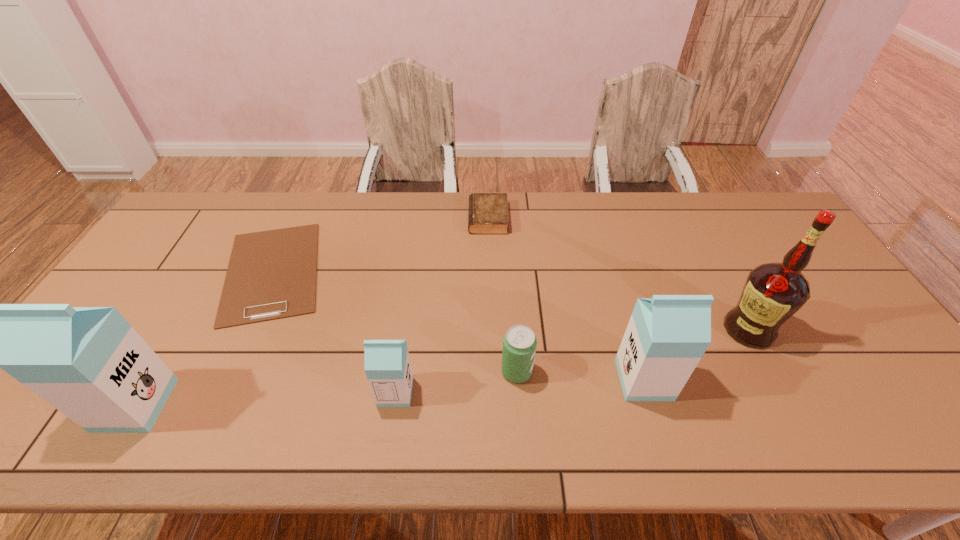
The image size is (960, 540). Identify the location of vacant space that satisfies the following two spatial constraints: 1. on the label of the alcohol; 2. on the front side of the fifth tallest object. (770, 372).

This screenshot has width=960, height=540. Find the location of `free space that satisfies the following two spatial constraints: 1. on the spine side of the diary; 2. on the front side of the leftmost milk carton`. free space that satisfies the following two spatial constraints: 1. on the spine side of the diary; 2. on the front side of the leftmost milk carton is located at coordinates (492, 405).

You are a GUI agent. You are given a task and a screenshot of the screen. Output one action in this format:
    pyautogui.click(x=<x>, y=<y>)
    Task: Click on the vacant region that satisfies the following two spatial constraints: 1. on the front side of the soda; 2. on the left side of the clipboard
    
    Given the screenshot: What is the action you would take?
    pyautogui.click(x=227, y=372)

Where is `free region that satisfies the following two spatial constraints: 1. on the front side of the soda; 2. on the left side of the clipboard`? Image resolution: width=960 pixels, height=540 pixels. free region that satisfies the following two spatial constraints: 1. on the front side of the soda; 2. on the left side of the clipboard is located at coordinates (227, 372).

Find the location of `free location that satisfies the following two spatial constraints: 1. on the front side of the rightmost milk carton; 2. on the left side of the clipboard`. free location that satisfies the following two spatial constraints: 1. on the front side of the rightmost milk carton; 2. on the left side of the clipboard is located at coordinates (223, 380).

Locate an element on the screen. This screenshot has height=540, width=960. vacant space that satisfies the following two spatial constraints: 1. on the front side of the soda; 2. on the right side of the shortest object is located at coordinates (227, 372).

The height and width of the screenshot is (540, 960). I want to click on free point that satisfies the following two spatial constraints: 1. on the label of the rightmost object; 2. on the front side of the soda, so click(x=770, y=372).